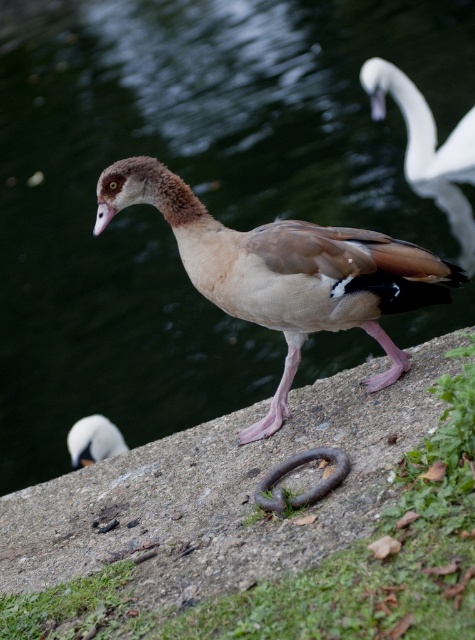
Is brown feathered duck at center bigger than white glossy swan at upper right?

Correct, brown feathered duck at center is larger in size than white glossy swan at upper right.

Is brown feathered duck at center to the left of white glossy swan at upper right from the viewer's perspective?

Correct, you'll find brown feathered duck at center to the left of white glossy swan at upper right.

Is point (226, 228) positioned behind point (409, 122)?

No, it is in front of (409, 122).

Locate an element on the screen. brown feathered duck at center is located at coordinates (288, 273).

Who is taller, brown feathered duck at center or white matte beak at upper right?

Standing taller between the two is brown feathered duck at center.

Between brown feathered duck at center and white matte beak at upper right, which one is positioned higher?

white matte beak at upper right is above.

Identify the location of brown feathered duck at center. (288, 273).

Is rusty metal ring at center below brown feathered duck at center?

Indeed, rusty metal ring at center is positioned under brown feathered duck at center.

Does point (275, 624) come in front of point (338, 324)?

Yes, it is in front of point (338, 324).

The width and height of the screenshot is (475, 640). What are the coordinates of `rusty metal ring at center` in the screenshot? It's located at (275, 529).